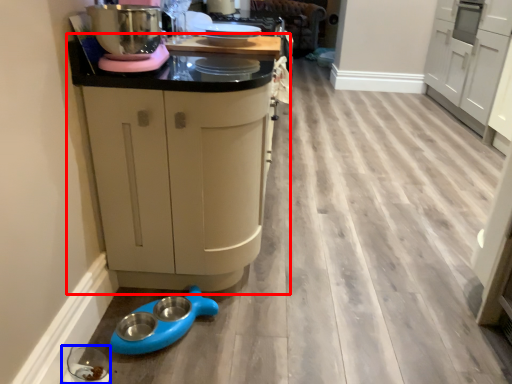
Question: Which object appears closest to the camera in this image, cabinetry (highlighted by a red box) or appliance (highlighted by a blue box)?

Choices:
 (A) cabinetry
 (B) appliance

Answer: (A)